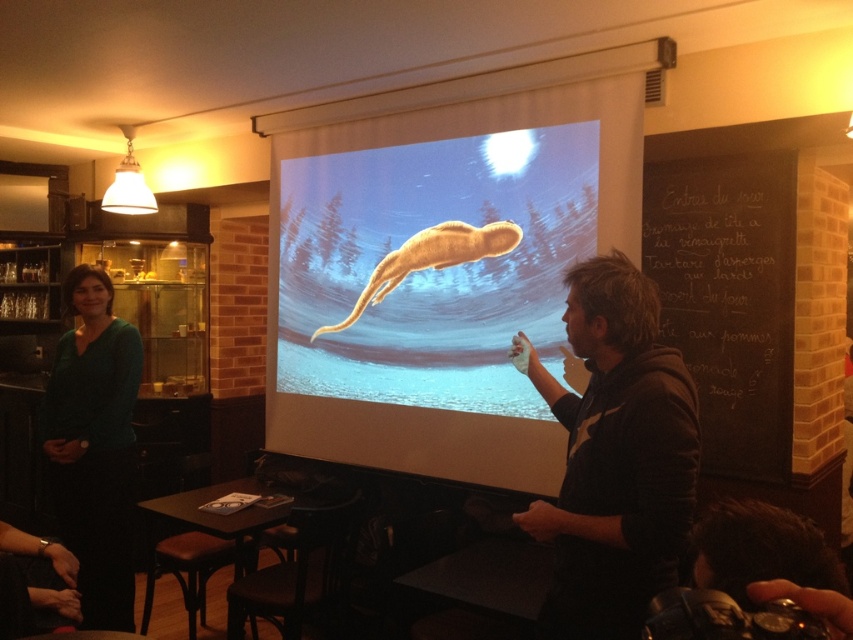
Question: Can you confirm if white matte projection screen at center is positioned to the left of dark brown hoodie at center?

Choices:
 (A) yes
 (B) no

Answer: (A)

Question: Based on their relative distances, which object is nearer to the dark brown hoodie at center?

Choices:
 (A) smooth orange whale at center
 (B) green matte dress at left
 (C) black chalkboard at upper right

Answer: (A)

Question: Is white matte projection screen at center to the right of black chalkboard at upper right from the viewer's perspective?

Choices:
 (A) no
 (B) yes

Answer: (A)

Question: Among these objects, which one is farthest from the camera?

Choices:
 (A) black chalkboard at upper right
 (B) white matte projection screen at center
 (C) dark brown wooden stool at lower left
 (D) green matte dress at left

Answer: (C)

Question: Which of the following is the closest to the observer?

Choices:
 (A) green matte dress at left
 (B) dark brown hoodie at center

Answer: (B)

Question: Where is dark brown hoodie at center located in relation to dark brown wooden stool at lower left in the image?

Choices:
 (A) left
 (B) right

Answer: (B)